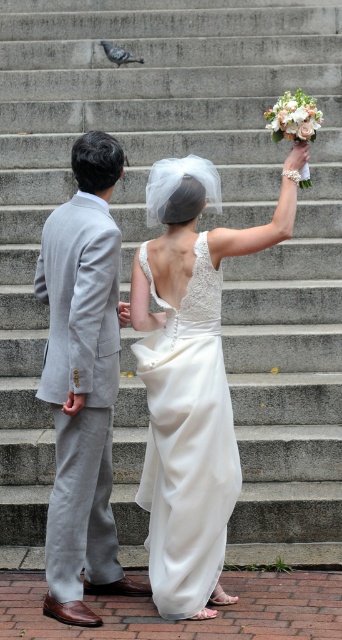
Can you confirm if white satin dress at center is positioned above gray feathered pigeon at upper center?

Incorrect, white satin dress at center is not positioned above gray feathered pigeon at upper center.

Can you confirm if white satin dress at center is shorter than gray feathered pigeon at upper center?

Incorrect, white satin dress at center's height does not fall short of gray feathered pigeon at upper center's.

Who is more forward, (224, 420) or (125, 64)?

Point (224, 420) is in front.

This screenshot has height=640, width=342. I want to click on white satin dress at center, so click(x=190, y=378).

Can you confirm if white lace dress at center is wider than gray feathered pigeon at upper center?

Yes, white lace dress at center is wider than gray feathered pigeon at upper center.

Identify the location of white lace dress at center. This screenshot has width=342, height=640. (187, 442).

Between white silk bouquet at upper center and gray feathered pigeon at upper center, which one appears on the right side from the viewer's perspective?

From the viewer's perspective, white silk bouquet at upper center appears more on the right side.

Which is more to the left, white silk bouquet at upper center or gray feathered pigeon at upper center?

From the viewer's perspective, gray feathered pigeon at upper center appears more on the left side.

The height and width of the screenshot is (640, 342). What are the coordinates of `white silk bouquet at upper center` in the screenshot? It's located at (294, 116).

The height and width of the screenshot is (640, 342). In order to click on white silk bouquet at upper center in this screenshot , I will do pyautogui.click(x=294, y=116).